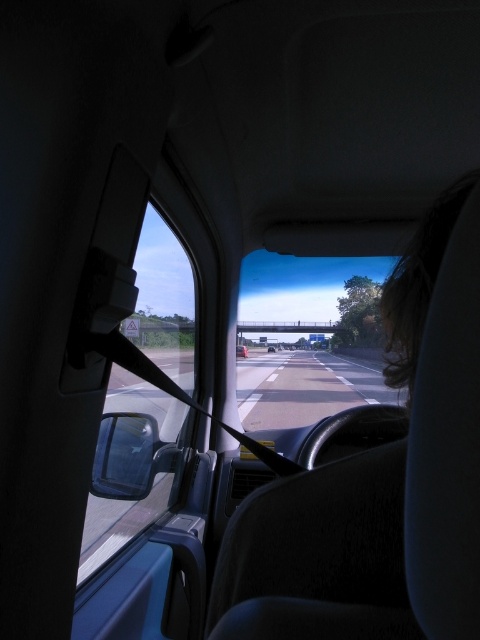
Question: From the image, what is the correct spatial relationship of transparent glass windshield at center in relation to metallic silver car at center?

Choices:
 (A) left
 (B) right

Answer: (B)

Question: Can you confirm if transparent glass windshield at center is wider than metallic silver car at center?

Choices:
 (A) yes
 (B) no

Answer: (A)

Question: Which object is the farthest from the transparent plastic side mirror at lower left?

Choices:
 (A) metallic silver car at center
 (B) transparent glass windshield at center

Answer: (B)

Question: Among these points, which one is farthest from the camera?

Choices:
 (A) (117, 433)
 (B) (245, 348)
 (C) (282, 426)

Answer: (B)

Question: Is transparent plastic side mirror at lower left thinner than metallic silver car at center?

Choices:
 (A) no
 (B) yes

Answer: (B)

Question: Which point is closer to the camera?

Choices:
 (A) (135, 464)
 (B) (277, 337)

Answer: (A)